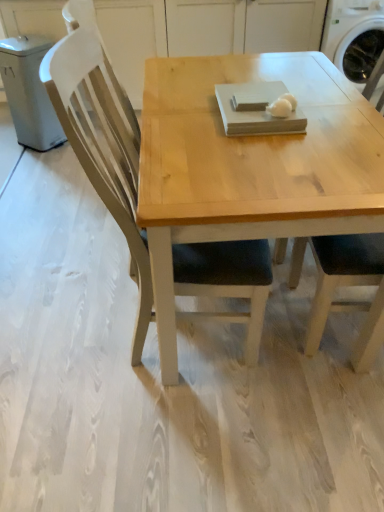
The height and width of the screenshot is (512, 384). I want to click on matte wood chair at right, so click(x=344, y=285).

What do you see at coordinates (349, 26) in the screenshot? The height and width of the screenshot is (512, 384). I see `white plastic washing machine at upper right` at bounding box center [349, 26].

This screenshot has height=512, width=384. What do you see at coordinates (282, 106) in the screenshot?
I see `white matte egg at center` at bounding box center [282, 106].

What are the coordinates of `matte wood chair at right` in the screenshot? It's located at (344, 285).

Who is bigger, white matte egg at center or white plastic washing machine at upper right?

With larger size is white plastic washing machine at upper right.

Is white matte egg at center aimed at white plastic washing machine at upper right?

No.

Identify the location of washing machine on the right of white matte egg at center. This screenshot has width=384, height=512. (349, 26).

Is white matte egg at center with white plastic washing machine at upper right?

No, white matte egg at center is not with white plastic washing machine at upper right.

From a real-world perspective, who is located lower, matte wood chair at right or white matte egg at center?

matte wood chair at right is physically lower.

Is matte wood chair at right not within white matte egg at center?

Yes.

Considering the relative positions of matte wood chair at right and white matte egg at center in the image provided, is matte wood chair at right in front of white matte egg at center?

Yes, matte wood chair at right is in front of white matte egg at center.

Is matte wood chair at right facing towards white matte egg at center?

Yes, matte wood chair at right is aimed at white matte egg at center.

Is white plastic washing machine at upper right in front of matte wood chair at right?

That is False.

From a real-world perspective, is white plastic washing machine at upper right beneath matte wood chair at right?

Yes, from a real-world perspective, white plastic washing machine at upper right is beneath matte wood chair at right.

Are white plastic washing machine at upper right and matte wood chair at right located far from each other?

Yes, white plastic washing machine at upper right is far from matte wood chair at right.

Is point (343, 36) closer or farther from the camera than point (371, 248)?

Point (343, 36) is farther from the camera than point (371, 248).

Considering the sizes of white matte egg at center and matte wood chair at right in the image, is white matte egg at center bigger or smaller than matte wood chair at right?

Considering their sizes, white matte egg at center takes up less space than matte wood chair at right.

Which of these two, white matte egg at center or matte wood chair at right, stands taller?

matte wood chair at right.

Does point (278, 113) appear closer or farther from the camera than point (315, 329)?

Point (278, 113) is closer to the camera than point (315, 329).

Is white plastic washing machine at upper right looking in the opposite direction of white matte egg at center?

No, white matte egg at center is not at the back of white plastic washing machine at upper right.

Is white plastic washing machine at upper right inside or outside of white matte egg at center?

white plastic washing machine at upper right exists outside the volume of white matte egg at center.

Looking at this image, from a real-world perspective, who is located higher, white plastic washing machine at upper right or white matte egg at center?

From a 3D spatial view, white matte egg at center is above.

Which is behind, white plastic washing machine at upper right or white matte egg at center?

white plastic washing machine at upper right is more distant.

Who is smaller, matte wood chair at right or white plastic washing machine at upper right?

Smaller between the two is matte wood chair at right.

Which object is thinner, matte wood chair at right or white plastic washing machine at upper right?

With smaller width is matte wood chair at right.

Considering the positions of objects matte wood chair at right and white plastic washing machine at upper right in the image provided, who is more to the left, matte wood chair at right or white plastic washing machine at upper right?

matte wood chair at right is more to the left.

Locate an element on the screen. food that is below the white plastic washing machine at upper right (from the image's perspective) is located at coordinates (282, 106).

This screenshot has height=512, width=384. Find the location of `chair beneath the white matte egg at center (from a real-world perspective)`. chair beneath the white matte egg at center (from a real-world perspective) is located at coordinates (344, 285).

Looking at the image, which one is located further to white plastic washing machine at upper right, matte wood chair at right or white matte egg at center?

matte wood chair at right is positioned further to the anchor white plastic washing machine at upper right.

Estimate the real-world distances between objects in this image. Which object is closer to matte wood chair at right, white matte egg at center or white plastic washing machine at upper right?

The object closer to matte wood chair at right is white matte egg at center.

Based on their spatial positions, is white plastic washing machine at upper right or white matte egg at center closer to matte wood chair at right?

white matte egg at center is closer to matte wood chair at right.

Which object lies further to the anchor point white matte egg at center, white plastic washing machine at upper right or matte wood chair at right?

white plastic washing machine at upper right lies further to white matte egg at center than the other object.

Consider the image. Estimate the real-world distances between objects in this image. Which object is further from white plastic washing machine at upper right, white matte egg at center or matte wood chair at right?

matte wood chair at right is positioned further to the anchor white plastic washing machine at upper right.

Looking at the image, which one is located further to white matte egg at center, matte wood chair at right or white plastic washing machine at upper right?

Based on the image, white plastic washing machine at upper right appears to be further to white matte egg at center.

Locate an element on the screen. This screenshot has height=512, width=384. food located between matte wood chair at right and white plastic washing machine at upper right in the depth direction is located at coordinates (282, 106).